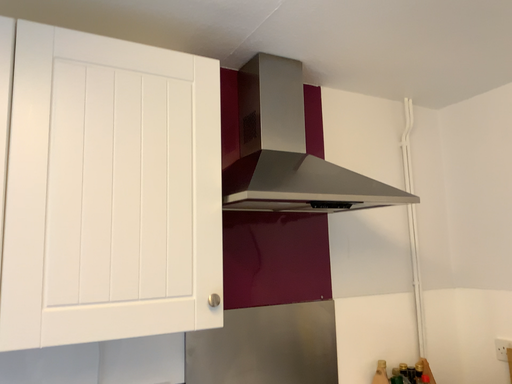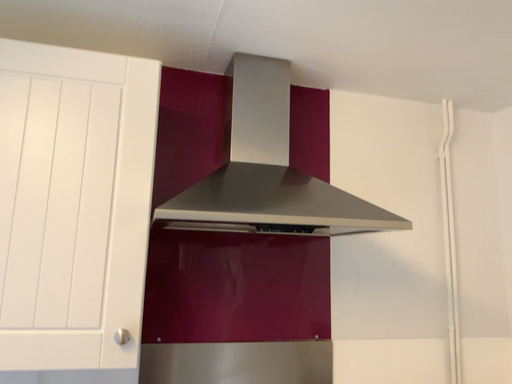
Question: Which way did the camera rotate in the video?

Choices:
 (A) rotated right
 (B) rotated left

Answer: (B)